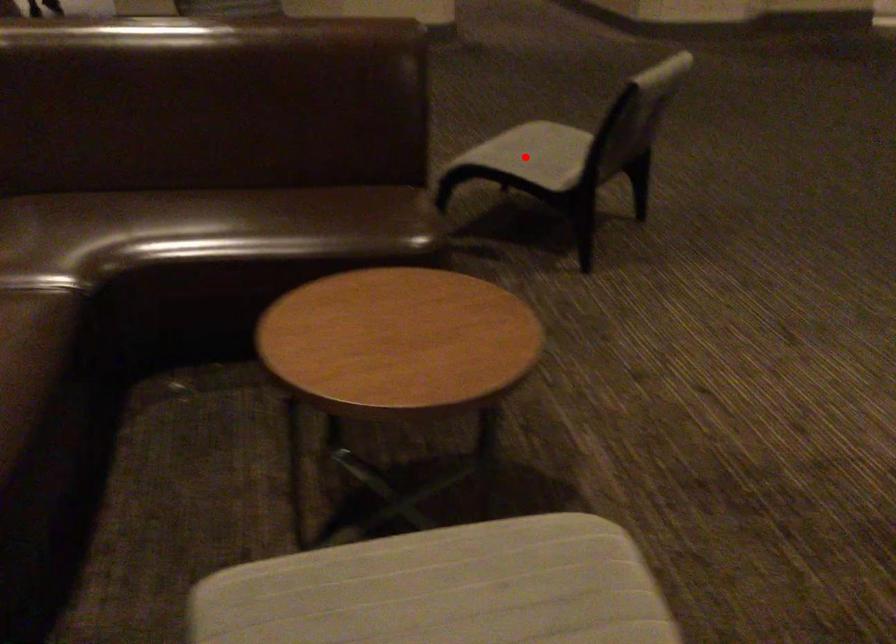
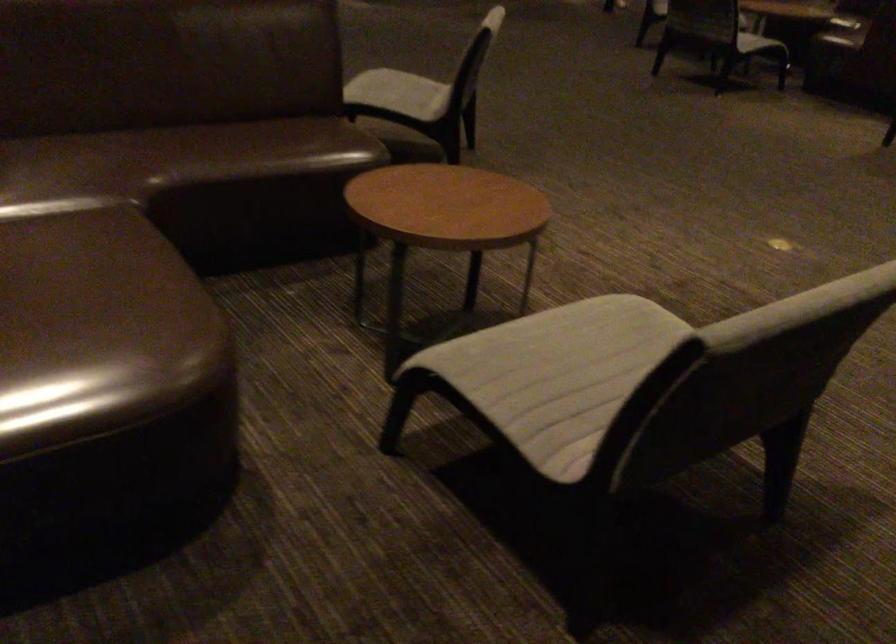
Where in the second image is the point corresponding to the highlighted location from the first image?

(399, 93)